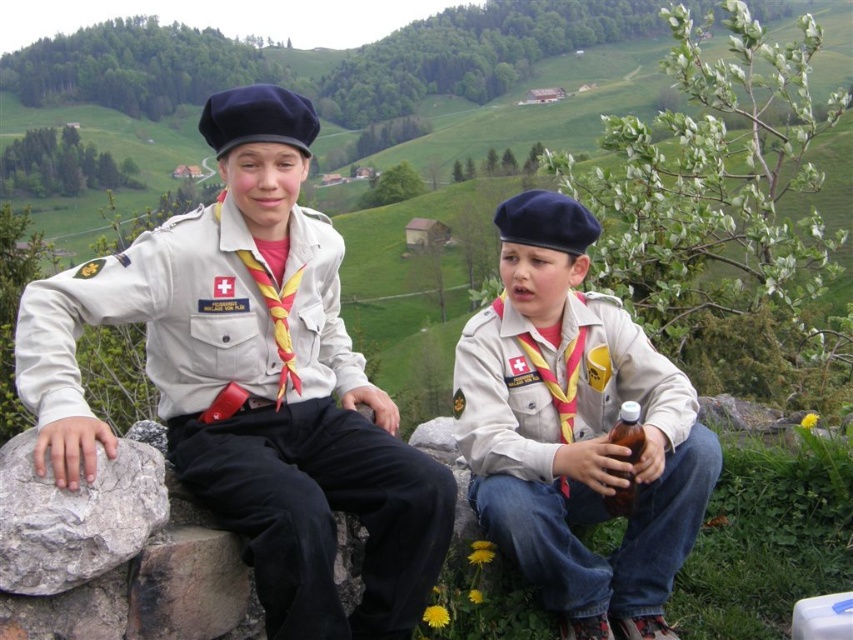
Question: Does matte khaki uniform at lower right come behind brown glass bottle at lower right?

Choices:
 (A) yes
 (B) no

Answer: (A)

Question: Which point appears farthest from the camera in this image?

Choices:
 (A) (531, 410)
 (B) (618, 442)

Answer: (A)

Question: Which of the following is the closest to the observer?

Choices:
 (A) (611, 509)
 (B) (601, 332)

Answer: (A)

Question: Can you confirm if matte khaki shirt at upper left is smaller than gray rough rock at left?

Choices:
 (A) no
 (B) yes

Answer: (B)

Question: Can you confirm if matte khaki shirt at upper left is positioned to the right of brown glass bottle at lower right?

Choices:
 (A) yes
 (B) no

Answer: (B)

Question: Based on their relative distances, which object is farther from the matte khaki shirt at upper left?

Choices:
 (A) matte khaki uniform at lower right
 (B) gray rough rock at left

Answer: (A)